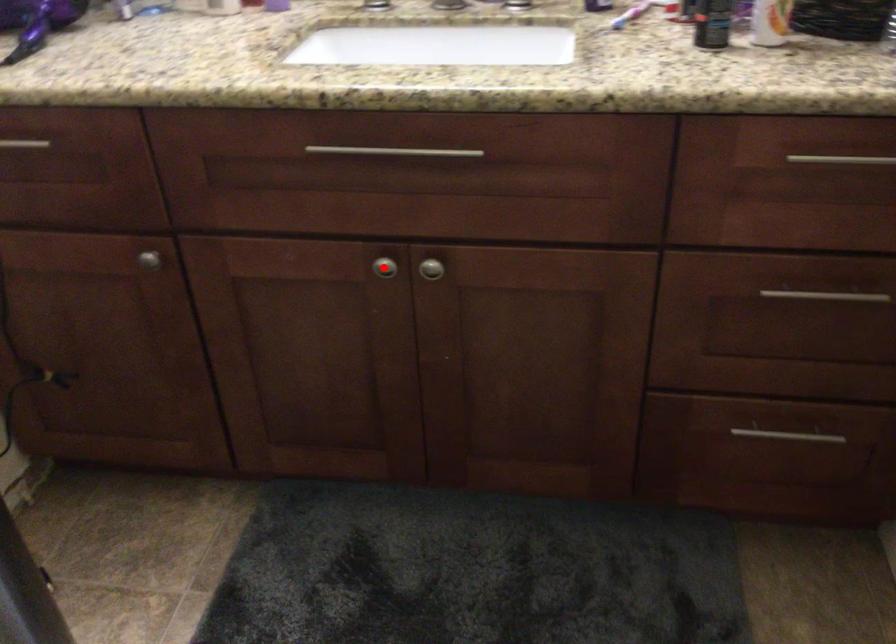
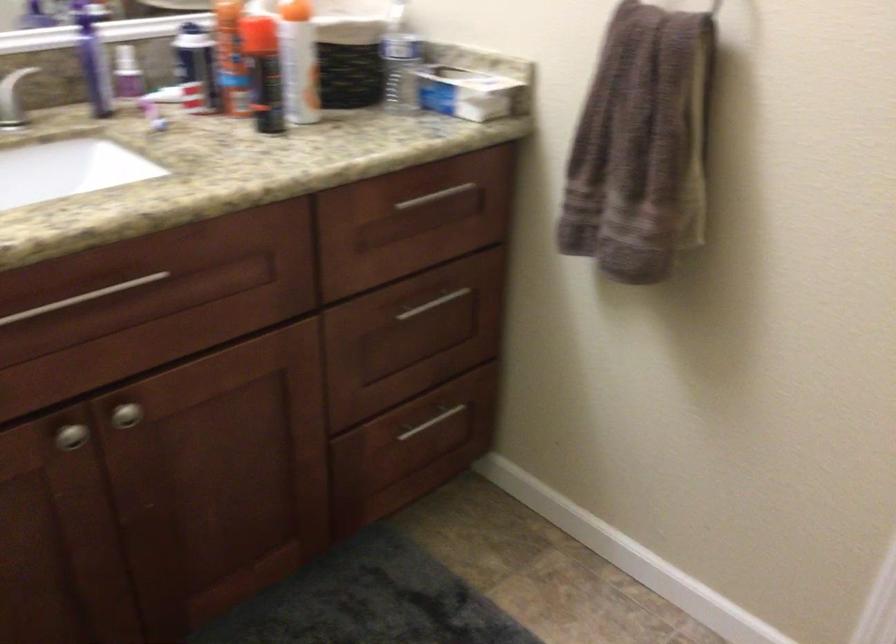
Question: I am providing you with two images of the same scene from different viewpoints. A red point is shown in image1. For the corresponding object point in image2, is it positioned nearer or farther from the camera?

Choices:
 (A) Nearer
 (B) Farther

Answer: (A)